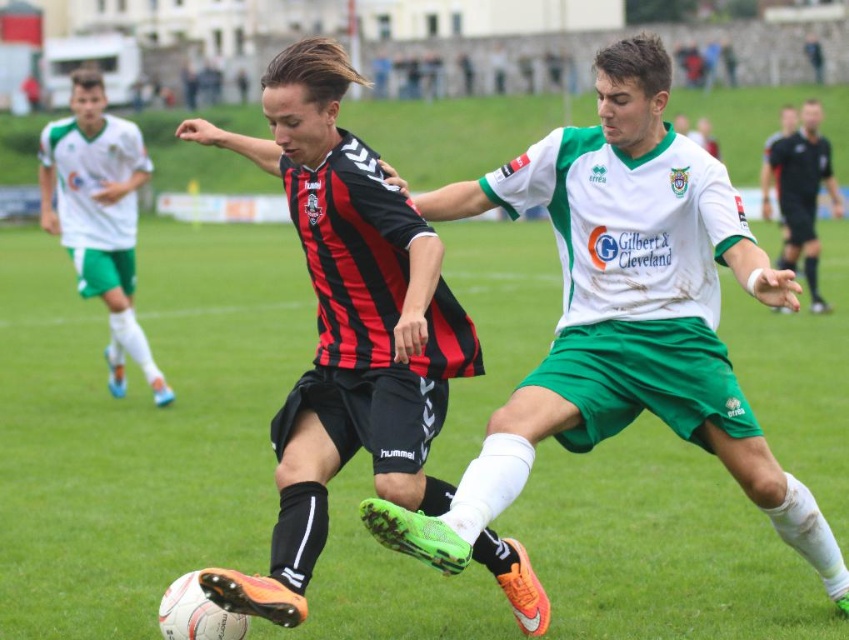
What are the coordinates of `matte black shorts at center` in the screenshot? It's located at (99, 216).

Identify the location of matte black shorts at center. (99, 216).